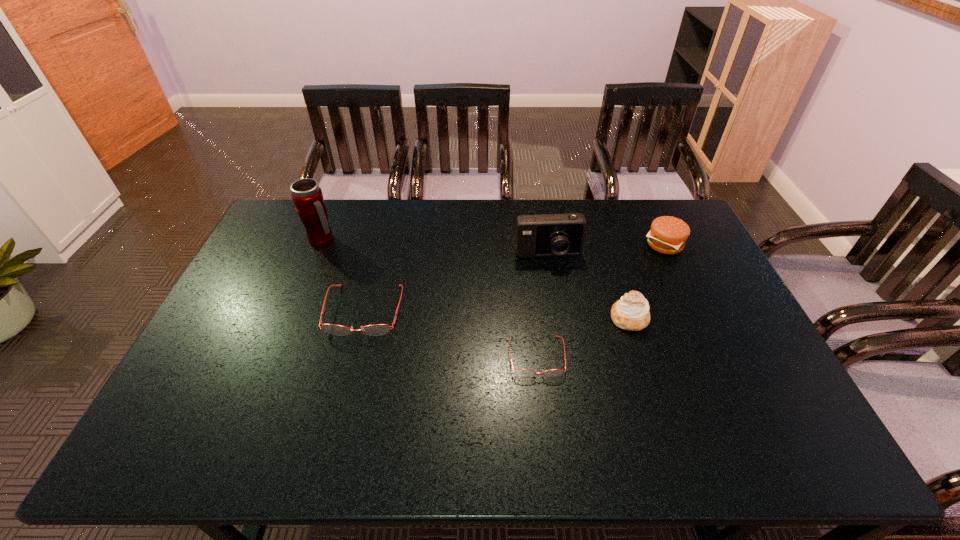
The image size is (960, 540). In order to click on vacant point that satisfies the following two spatial constraints: 1. on the front-facing side of the camera; 2. on the left side of the second object from right to left in this screenshot , I will do `click(559, 318)`.

You are a GUI agent. You are given a task and a screenshot of the screen. Output one action in this format:
    pyautogui.click(x=<x>, y=<y>)
    Task: Click on the vacant space that satisfies the following two spatial constraints: 1. on the side with the handle of the pastry; 2. on the left side of the tallest object
    This screenshot has width=960, height=540.
    Given the screenshot: What is the action you would take?
    pyautogui.click(x=291, y=318)